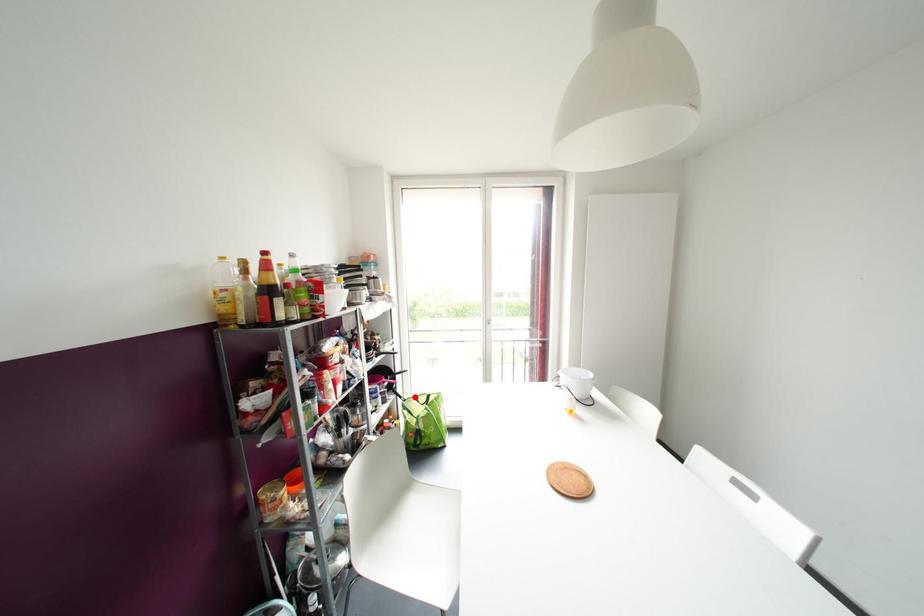
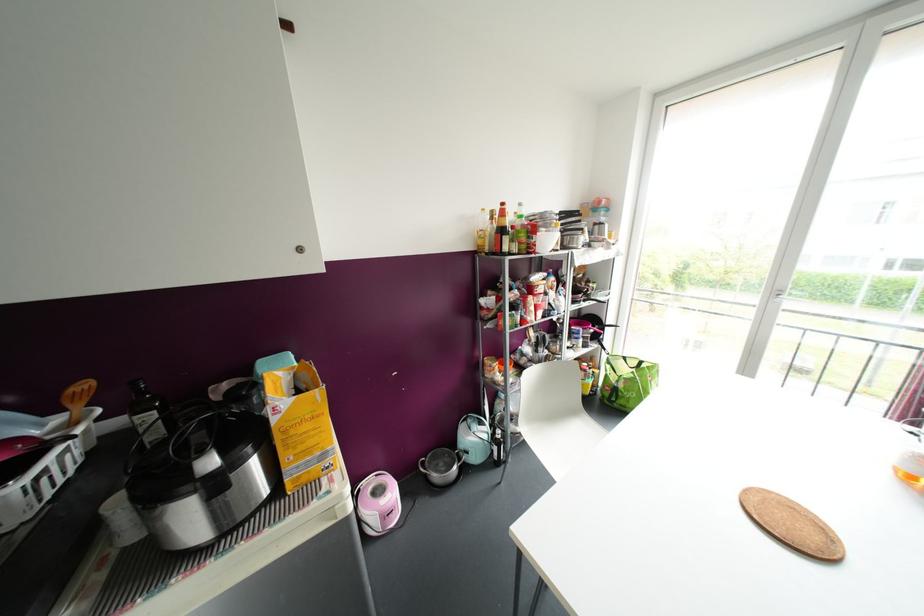
Locate, in the second image, the point that corresponds to the highlighted location in the first image.

(624, 358)